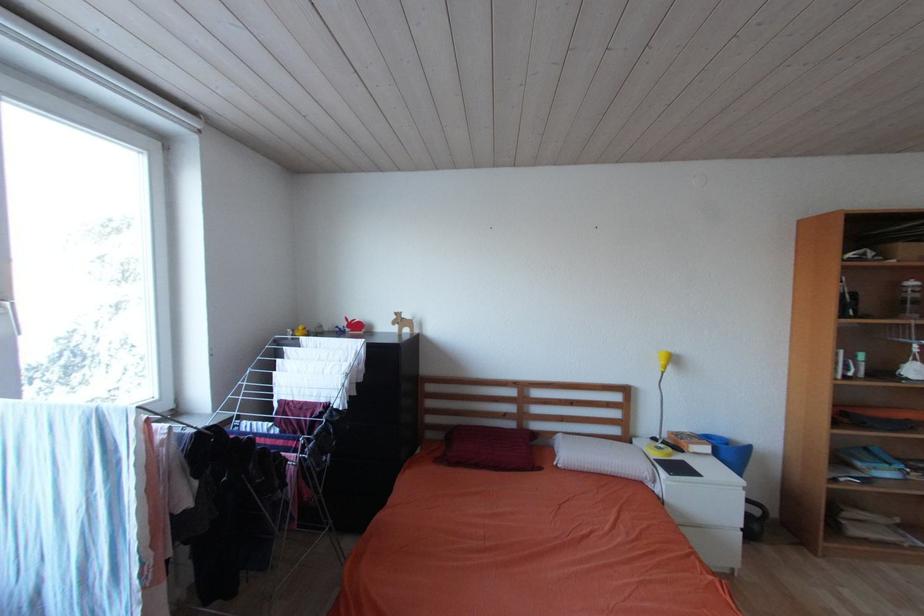
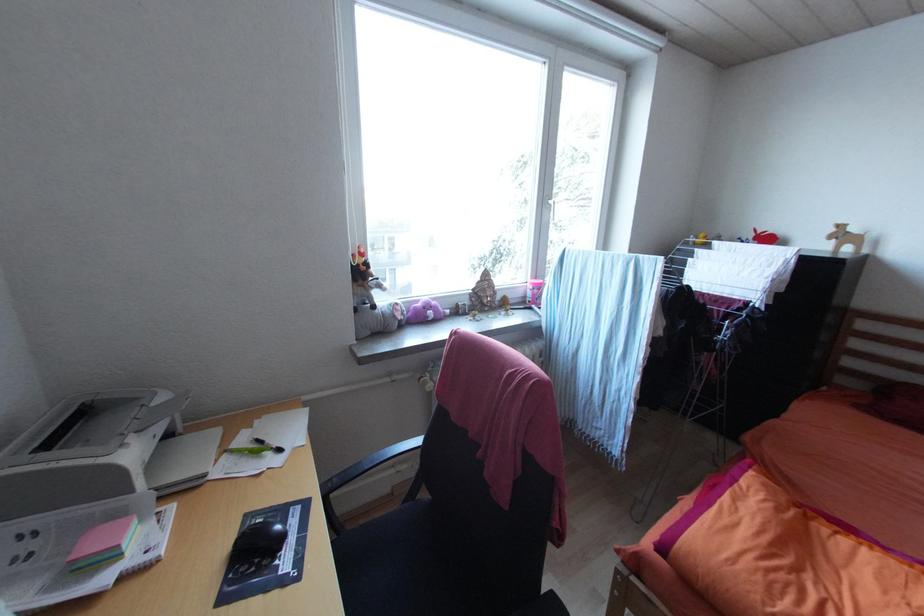
Question: The camera is either moving clockwise (left) or counter-clockwise (right) around the object. The first image is from the beginning of the video and the second image is from the end. Is the camera moving left or right when shooting the video?

Choices:
 (A) Left
 (B) Right

Answer: (B)